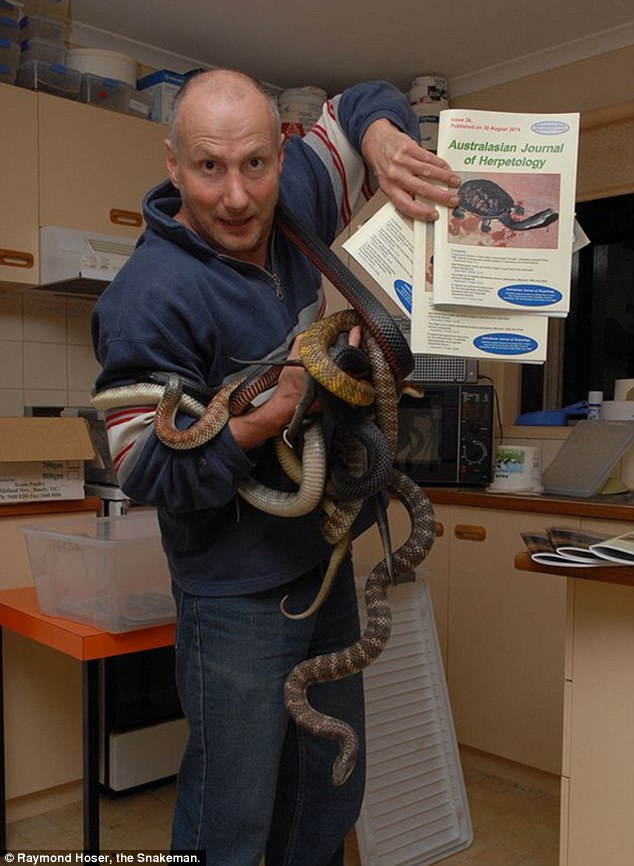
Image resolution: width=634 pixels, height=866 pixels. Identify the location of cardboard box. (164, 88), (16, 455).